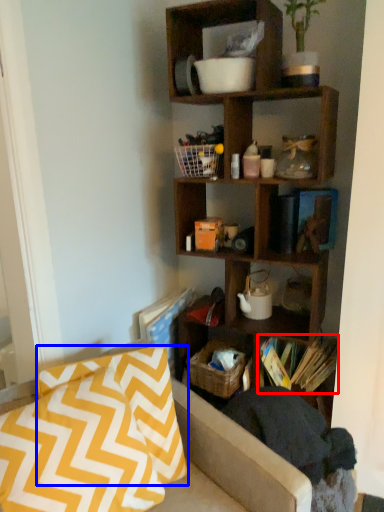
Question: Which point is closer to the camera, book (highlighted by a red box) or pillow (highlighted by a blue box)?

Choices:
 (A) book
 (B) pillow

Answer: (B)